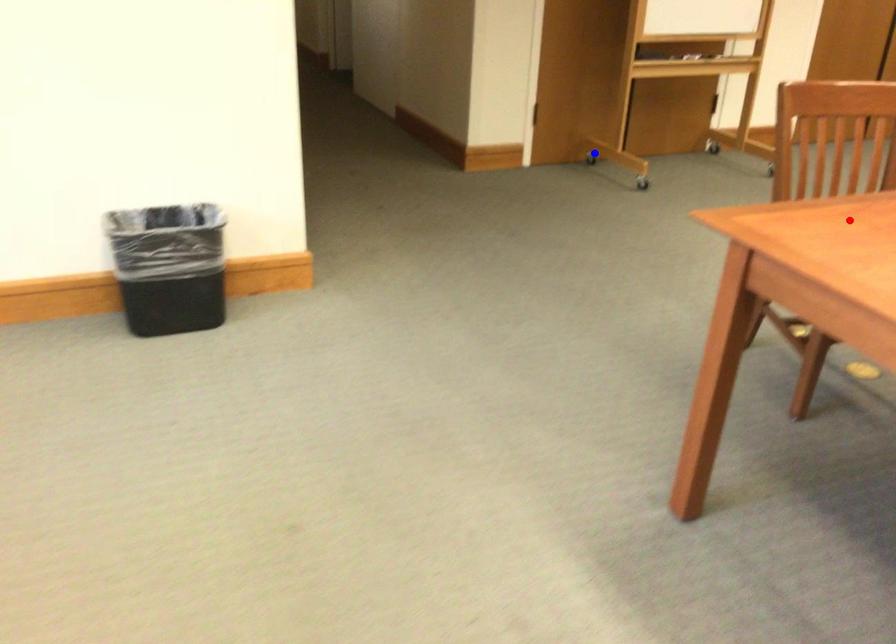
Question: Which of the two points in the image is closer to the camera?

Choices:
 (A) Blue point is closer.
 (B) Red point is closer.

Answer: (B)